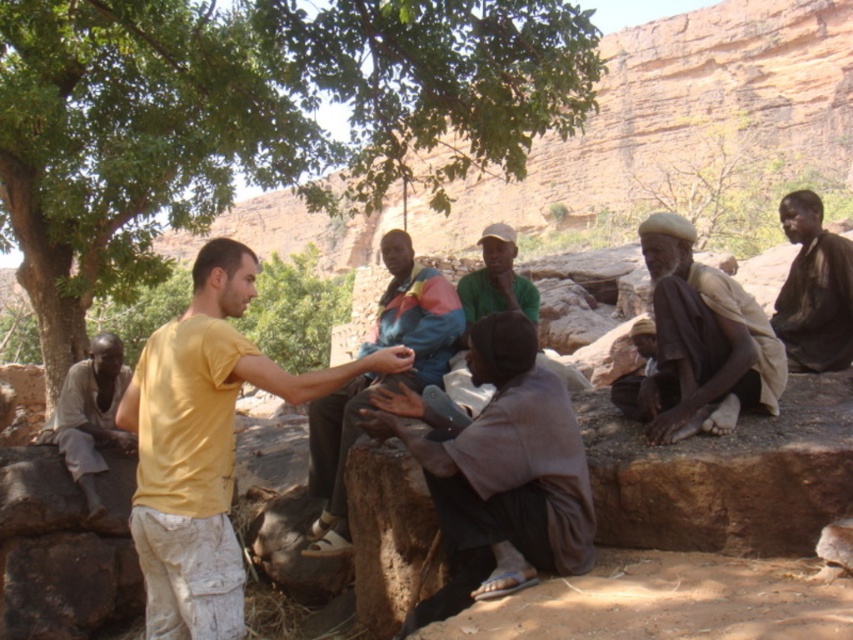
You are an observer at the scene described. You notice two fabrics in the image. The first is the multicolored fabric at center, and the second is the gray fabric pants at lower left. Which of these fabrics is larger in size?

The multicolored fabric at center is bigger than the gray fabric pants at lower left according to the description.

You are a photographer positioned at the camera location. You want to take a closeup shot of the point at coordinate (514, 564) and the point at coordinate (843, 348). Which point should you focus on first to ensure it is in sharp focus?

You should focus on point (514, 564) first because it is closer to the camera than point (843, 348). Since it is nearer, focusing on it will ensure that this point is in sharp focus before the other.

You are a hiker carrying a 1.5 meter long tent pole. You need to set up camp between the brown fabric cloth at center and the dark brown fabric at right. Can the tent pole fit horizontally in the space between them?

The distance between the brown fabric cloth at center and the dark brown fabric at right is 15.09 meters. Since the tent pole is only 1.5 meters long, it can easily fit horizontally in the space between them.